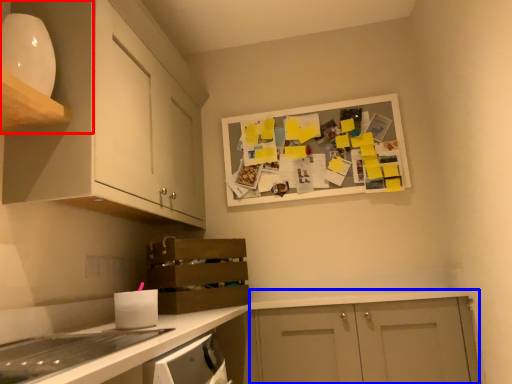
Question: Which object appears closest to the camera in this image, cabinetry (highlighted by a red box) or cabinetry (highlighted by a blue box)?

Choices:
 (A) cabinetry
 (B) cabinetry

Answer: (A)